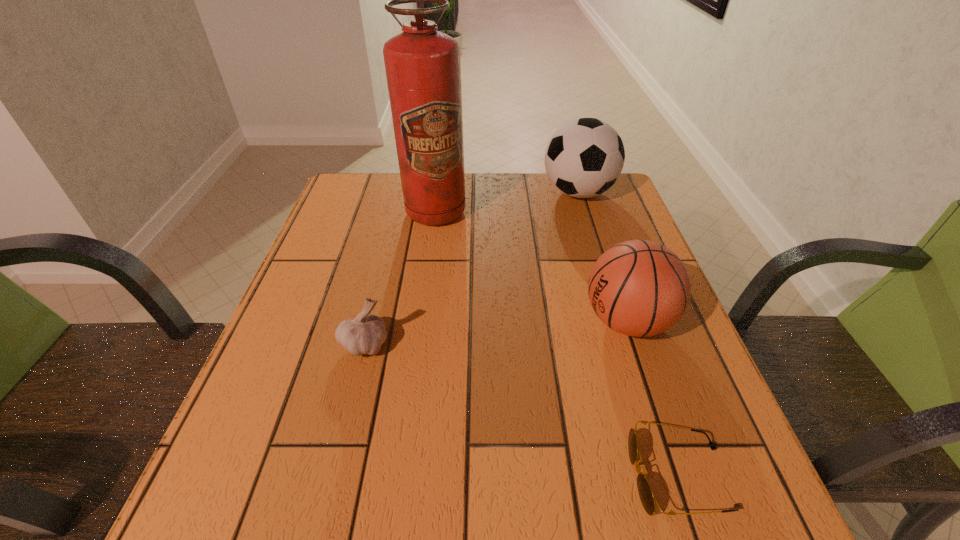
Identify the location of vacant space located 0.350m on the surface of the third shortest object near the brand logo. The width and height of the screenshot is (960, 540). (411, 321).

Find the location of `vacant space located 0.320m on the right of the second shortest object`. vacant space located 0.320m on the right of the second shortest object is located at coordinates pos(553,345).

Where is `free space located 0.050m on the front-facing side of the shortest object`? The image size is (960, 540). free space located 0.050m on the front-facing side of the shortest object is located at coordinates (598, 477).

What are the coordinates of `free region located on the front-facing side of the shortest object` in the screenshot? It's located at (539, 477).

This screenshot has height=540, width=960. Identify the location of vacant space located 0.150m on the front-facing side of the shortest object. (x=533, y=477).

Locate an element on the screen. fire extinguisher situated at the far edge is located at coordinates point(423,70).

Identify the location of soccer ball that is at the far edge. (584, 158).

I want to click on object at the near edge, so click(x=647, y=498).

The image size is (960, 540). What are the coordinates of `object located in the left edge section of the desktop` in the screenshot? It's located at (365, 334).

Where is `soccer ball present at the right edge`? This screenshot has height=540, width=960. soccer ball present at the right edge is located at coordinates (584, 158).